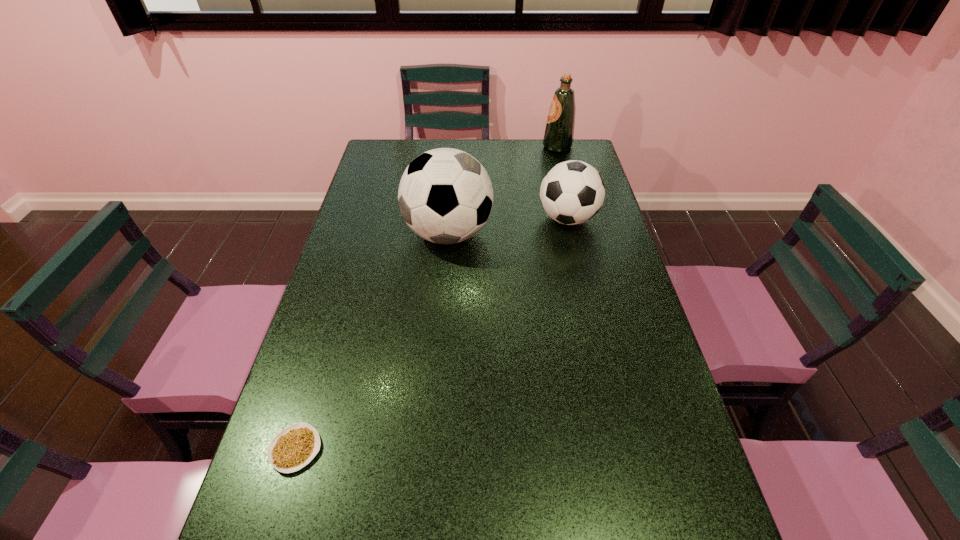
You are a GUI agent. You are given a task and a screenshot of the screen. Output one action in this format:
    pyautogui.click(x=<x>, y=<y>)
    Task: Click on the farthest object
    
    Given the screenshot: What is the action you would take?
    pyautogui.click(x=559, y=134)

Locate an element on the screen. the third object from right to left is located at coordinates (445, 195).

At what (x,y) coordinates should I click in order to perform the action: click on the left soccer ball. Please return your answer as a coordinate pair (x, y). Image resolution: width=960 pixels, height=540 pixels. Looking at the image, I should click on (445, 195).

This screenshot has width=960, height=540. I want to click on the third tallest object, so click(572, 192).

Identify the location of the right soccer ball. This screenshot has height=540, width=960. (572, 192).

Where is `legume`? The width and height of the screenshot is (960, 540). legume is located at coordinates (294, 447).

The image size is (960, 540). I want to click on the nearest object, so click(x=294, y=447).

Where is `free space located 0.360m on the front-facing side of the olive oil`? free space located 0.360m on the front-facing side of the olive oil is located at coordinates (455, 147).

In order to click on vacant space situated on the front-facing side of the olive oil in this screenshot , I will do `click(455, 147)`.

Where is `vacant space located 0.140m on the front-facing side of the olive oil`? This screenshot has height=540, width=960. vacant space located 0.140m on the front-facing side of the olive oil is located at coordinates (509, 147).